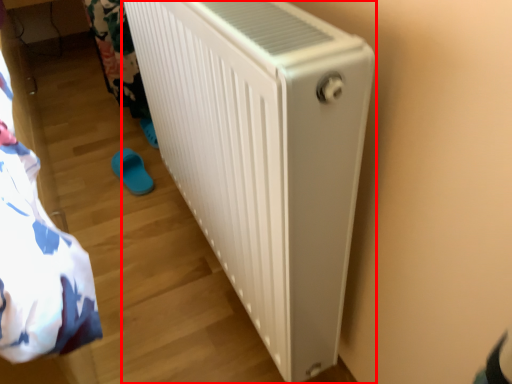
Question: Observing the image, what is the correct spatial positioning of home appliance (annotated by the red box) in reference to footwear?

Choices:
 (A) left
 (B) right

Answer: (B)